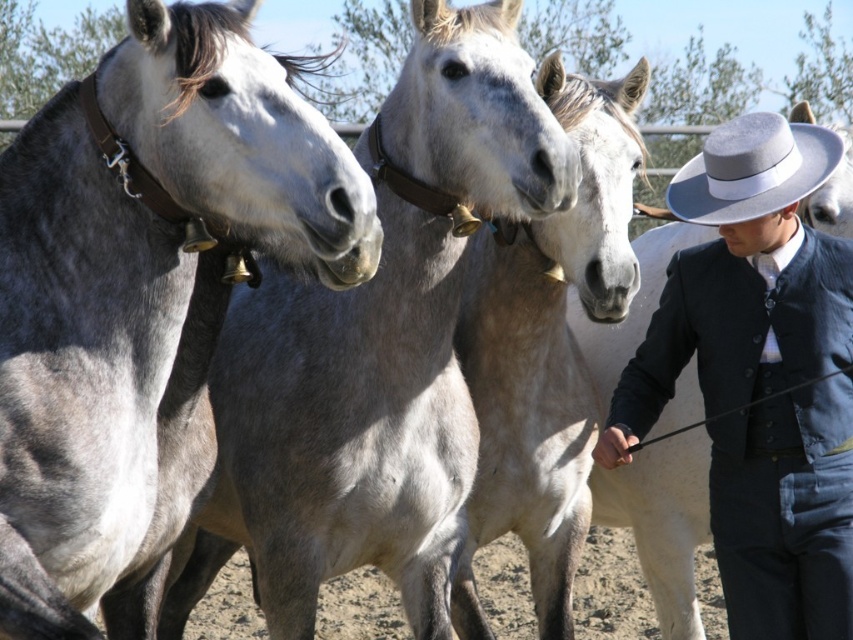
Question: From the image, what is the correct spatial relationship of gray smooth horse at center in relation to gray matte horse at center?

Choices:
 (A) below
 (B) above

Answer: (A)

Question: Which of the following is the closest to the observer?

Choices:
 (A) (549, 474)
 (B) (4, 608)
 (C) (732, 579)

Answer: (B)

Question: Can you confirm if gray smooth horse at center is positioned above gray matte horse at center?

Choices:
 (A) no
 (B) yes

Answer: (A)

Question: Does dark blue fabric jacket at center right lie in front of gray felt cowboy hat at upper right?

Choices:
 (A) yes
 (B) no

Answer: (B)

Question: Estimate the real-world distances between objects in this image. Which object is farther from the gray felt cowboy hat at upper right?

Choices:
 (A) gray smooth horse at center
 (B) gray matte horse at left
 (C) gray matte horse at center

Answer: (B)

Question: Which of the following is the farthest from the observer?

Choices:
 (A) (766, 136)
 (B) (123, 602)
 (C) (556, 637)

Answer: (C)